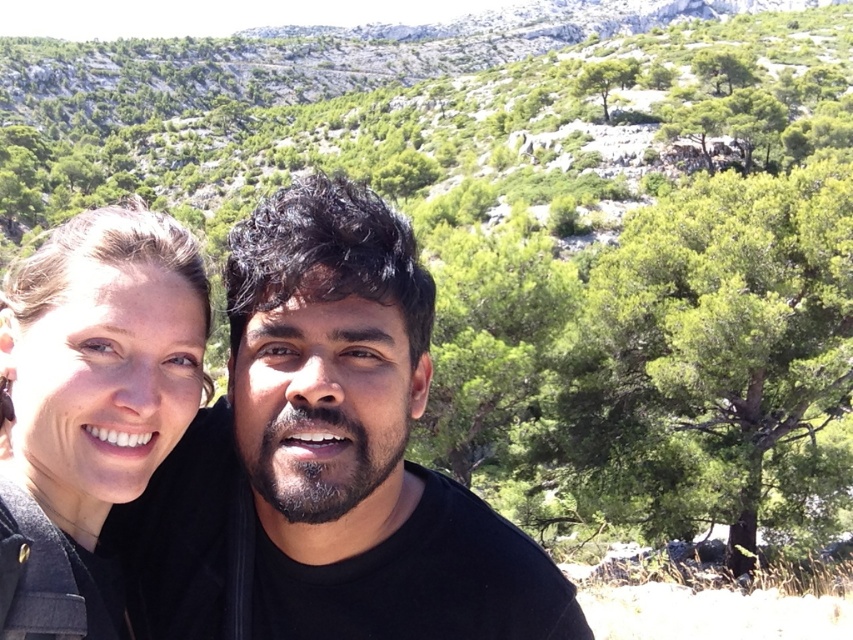
You are a photographer trying to capture the black matte shirt at center and the green leafy tree at upper right in a single frame. Based on their sizes, which object should you focus on first to ensure both are clearly visible in the photo?

The black matte shirt at center is smaller than the green leafy tree at upper right, so you should focus on the black matte shirt at center first to ensure its details are sharp while the larger tree will remain in focus more easily.

You are a photographer standing at the base of the scene and want to capture the green leafy tree at upper right in your shot. Given that your camera has a maximum zoom range of 35 meters, will you be able to focus on the tree without moving closer?

The green leafy tree at upper right is 39.25 meters away from the viewer. Since the camera can only zoom up to 35 meters, you won